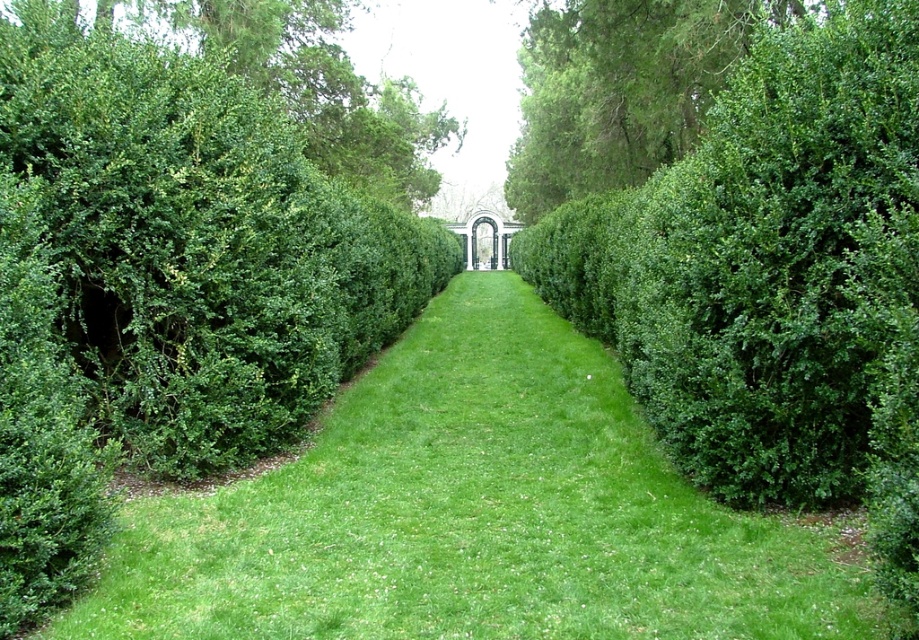
Is point (524, 45) positioned after point (349, 26)?

Yes, point (524, 45) is behind point (349, 26).

Between point (696, 88) and point (445, 116), which one is positioned behind?

Point (445, 116)

Identify the location of green leafy bush at upper right. (619, 90).

Between green grass at center and green leafy bush at upper left, which one is positioned lower?

Positioned lower is green grass at center.

Is green grass at center smaller than green leafy bush at upper left?

Yes, green grass at center is smaller than green leafy bush at upper left.

Who is more forward, [479,608] or [100,13]?

Positioned in front is point [479,608].

I want to click on green grass at center, so click(x=475, y=513).

Does green grass at center appear on the left side of green leafy bush at upper right?

Correct, you'll find green grass at center to the left of green leafy bush at upper right.

At what (x,y) coordinates should I click in order to perform the action: click on green grass at center. Please return your answer as a coordinate pair (x, y). Image resolution: width=919 pixels, height=640 pixels. Looking at the image, I should click on (475, 513).

This screenshot has height=640, width=919. Describe the element at coordinates (475, 513) in the screenshot. I see `green grass at center` at that location.

I want to click on green grass at center, so click(475, 513).